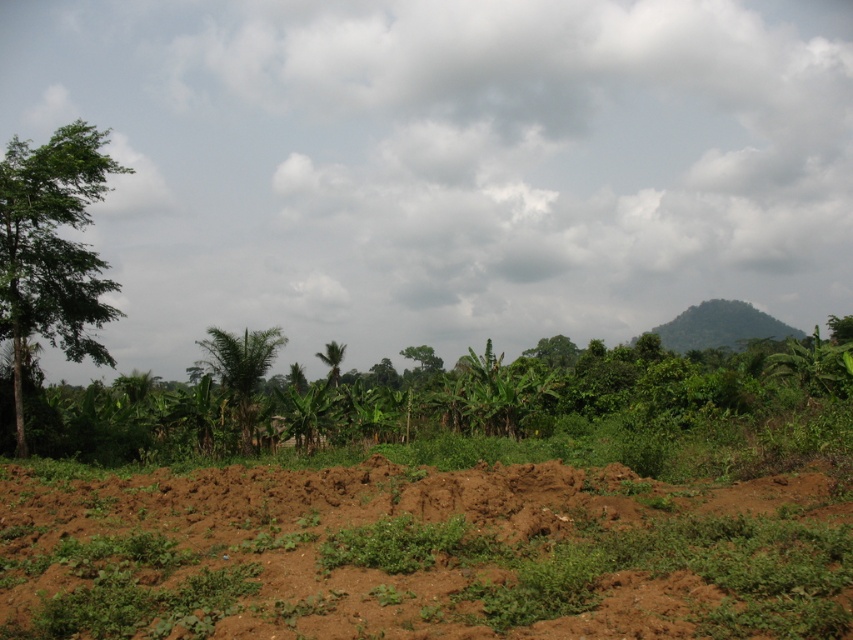
What do you see at coordinates (421, 554) in the screenshot? I see `brown soil at lower center` at bounding box center [421, 554].

Does brown soil at lower center have a greater height compared to green leafy palm at center?

In fact, brown soil at lower center may be shorter than green leafy palm at center.

Based on the photo, measure the distance between point (9,465) and camera.

Point (9,465) and camera are 19.27 meters apart.

The width and height of the screenshot is (853, 640). In order to click on brown soil at lower center in this screenshot , I will do `click(421, 554)`.

Looking at this image, does brown soil at lower center have a larger size compared to green leafy palm tree at center?

No, brown soil at lower center is not bigger than green leafy palm tree at center.

Is point (42, 515) positioned after point (334, 353)?

No.

Who is more forward, (589,472) or (318,355)?

Point (589,472) is in front.

The height and width of the screenshot is (640, 853). I want to click on brown soil at lower center, so click(x=421, y=554).

In the scene shown: Does green leafy tree at left have a smaller size compared to green leafy palm at center?

Yes, green leafy tree at left is smaller than green leafy palm at center.

From the picture: Can you confirm if green leafy tree at left is positioned below green leafy palm at center?

No, green leafy tree at left is not below green leafy palm at center.

Where is `green leafy tree at left`? Image resolution: width=853 pixels, height=640 pixels. green leafy tree at left is located at coordinates (51, 250).